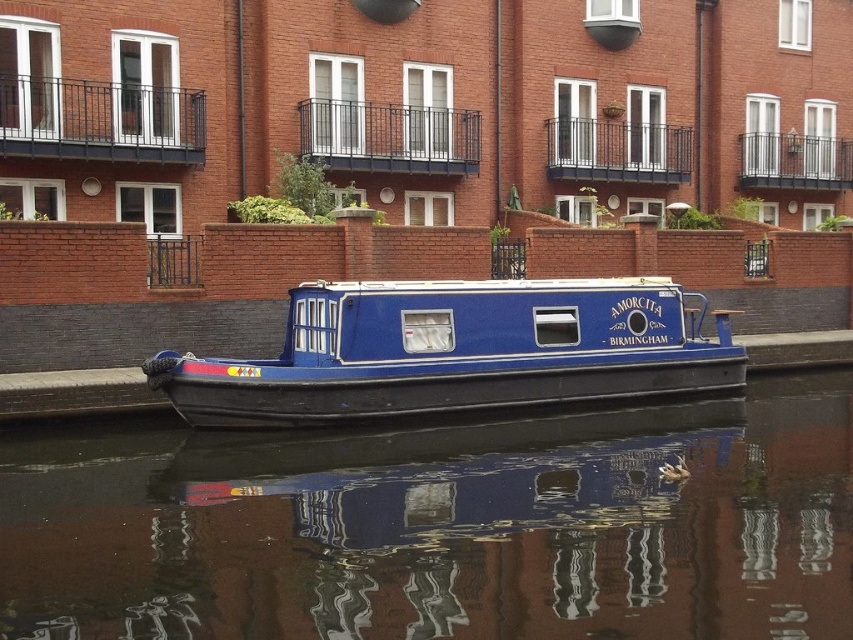
Question: Is the position of glossy blue water at center less distant than that of blue polished wood barge at center?

Choices:
 (A) yes
 (B) no

Answer: (A)

Question: Which point is farther to the camera?

Choices:
 (A) (495, 368)
 (B) (178, 536)

Answer: (A)

Question: Can you confirm if glossy blue water at center is positioned to the left of blue polished wood barge at center?

Choices:
 (A) yes
 (B) no

Answer: (A)

Question: Does glossy blue water at center have a lesser width compared to blue polished wood barge at center?

Choices:
 (A) yes
 (B) no

Answer: (B)

Question: Which object is farther from the camera taking this photo?

Choices:
 (A) glossy blue water at center
 (B) blue polished wood barge at center

Answer: (B)